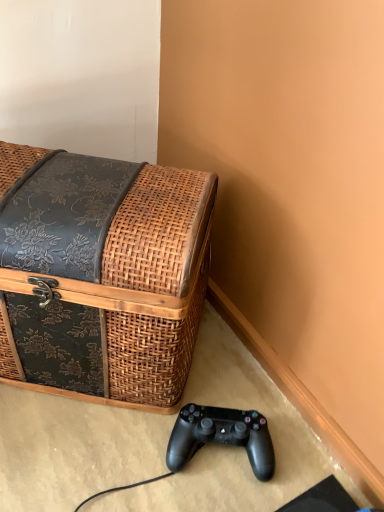
Locate an element on the screen. Image resolution: width=384 pixels, height=512 pixels. vacant region in front of woven wood trunk at left is located at coordinates (79, 451).